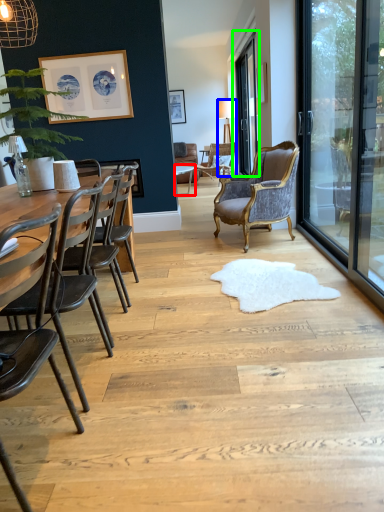
Question: Which is nearer to the round table (highlighted by a red box)? lamp (highlighted by a blue box) or window screen (highlighted by a green box).

Choices:
 (A) lamp
 (B) window screen

Answer: (A)